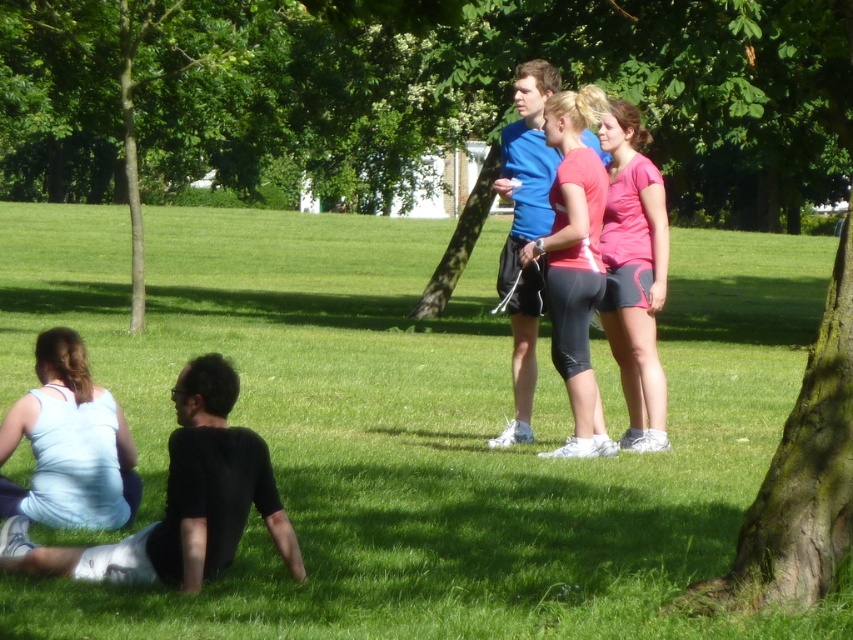
Question: Does black matte shirt at lower left appear on the left side of pink matte leggings at center?

Choices:
 (A) no
 (B) yes

Answer: (B)

Question: Does black matte shirt at lower left appear under pink fabric shorts at center?

Choices:
 (A) yes
 (B) no

Answer: (A)

Question: Which object is the closest to the pink matte leggings at center?

Choices:
 (A) light blue fabric at lower left
 (B) black matte shirt at lower left

Answer: (A)

Question: Estimate the real-world distances between objects in this image. Which object is farther from the green leafy tree at center?

Choices:
 (A) black matte shirt at lower left
 (B) pink matte leggings at center
 (C) light blue fabric at lower left
 (D) pink fabric shorts at center

Answer: (C)

Question: Which point appears farthest from the camera in this image?

Choices:
 (A) (636, 131)
 (B) (344, 621)
 (C) (595, 400)
 (D) (41, 548)

Answer: (A)

Question: Is light blue fabric at lower left wider than pink matte leggings at center?

Choices:
 (A) yes
 (B) no

Answer: (A)